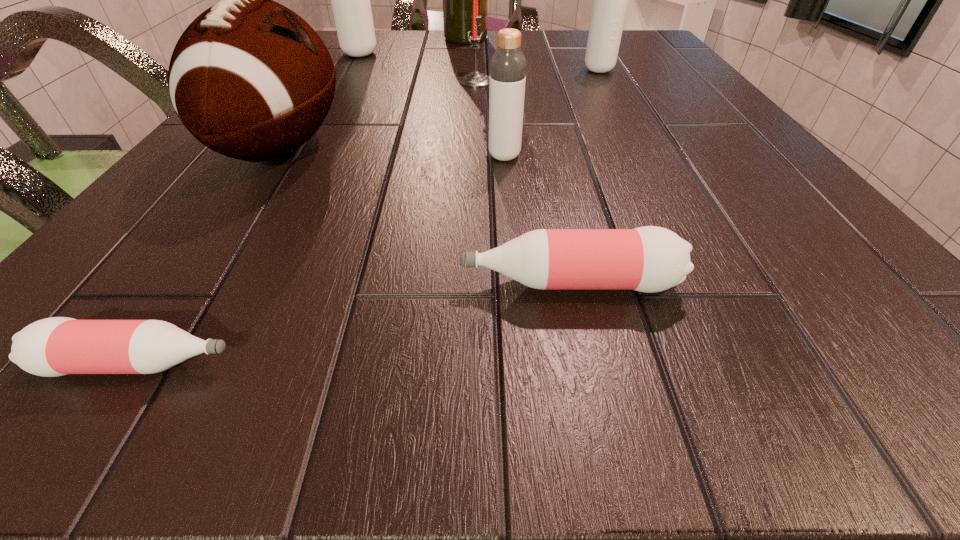
Locate an element on the screen. This screenshot has height=540, width=960. gray bottle that is the third nearest to the tallest object is located at coordinates (507, 79).

In order to click on gray bottle identified as the closest to the second nearest gray bottle in this screenshot , I will do `click(507, 79)`.